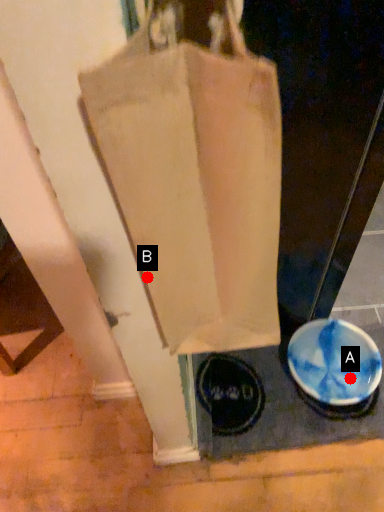
Question: Two points are circled on the image, labeled by A and B beside each circle. Which point is closer to the camera?

Choices:
 (A) A is closer
 (B) B is closer

Answer: (B)